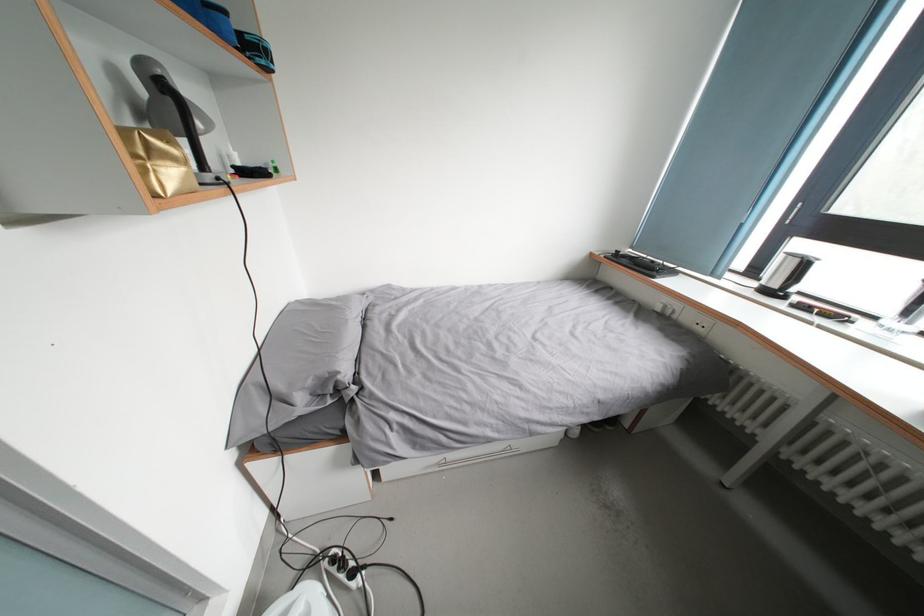
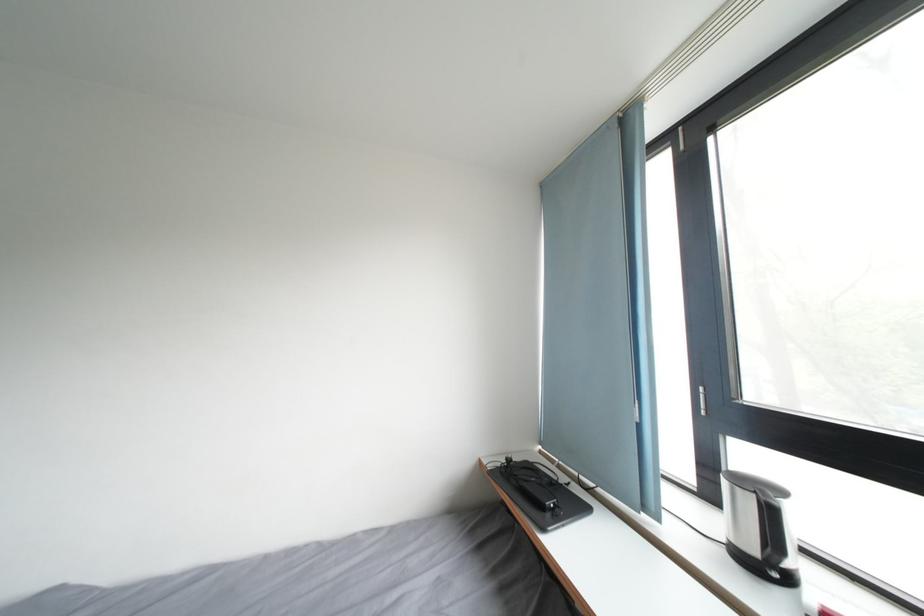
In the second image, find the point that corresponds to (x=811, y=270) in the first image.

(776, 517)